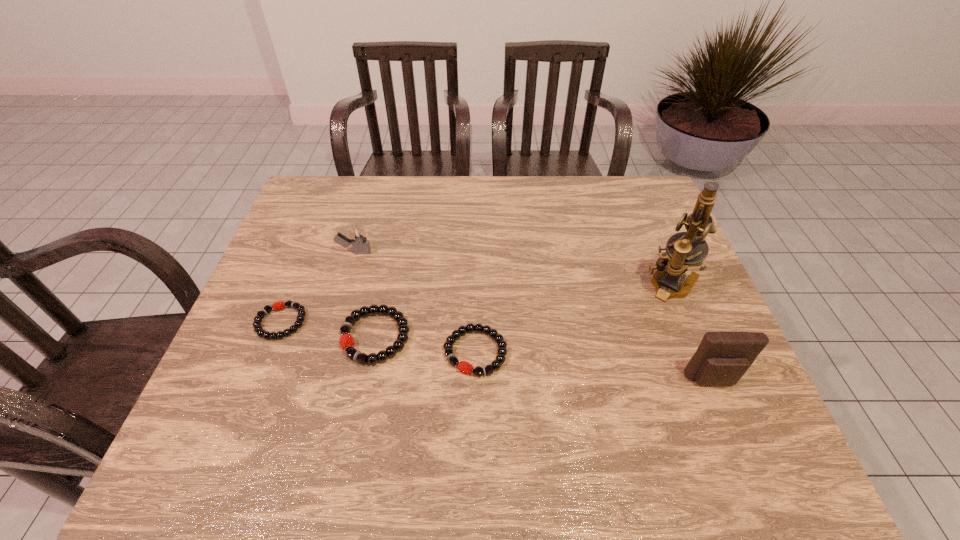
Locate an element on the screen. Image resolution: width=960 pixels, height=540 pixels. bracelet that stands as the closest to the shortest bracelet is located at coordinates (347, 344).